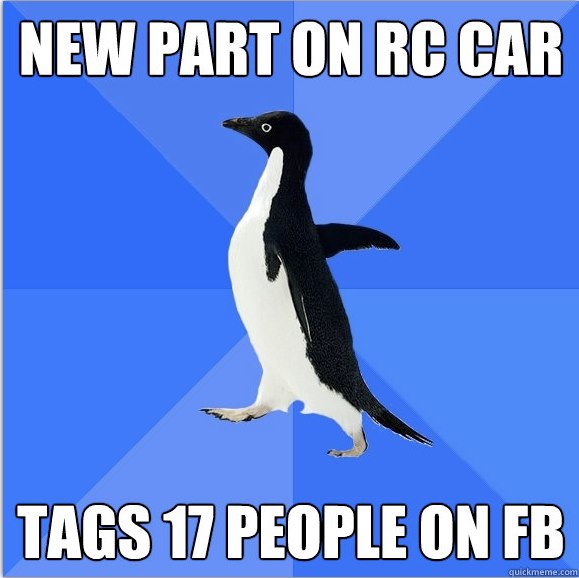
Locate an element on the screen. This screenshot has height=578, width=579. floor is located at coordinates (291, 464).